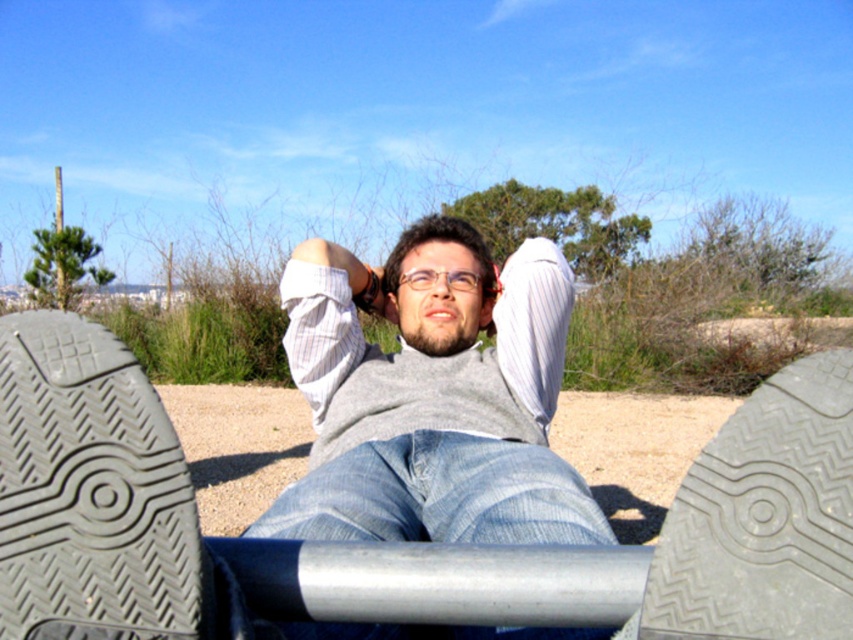
You are a photographer setting up a shoot in this outdoor scene. You need to place a small prop exactly between the gray rubber shoe at lower center and the denim at center. Based on their positions, where should you position the prop?

The gray rubber shoe at lower center is to the right of denim at center, so the prop should be placed midway between them, slightly to the left of the gray rubber shoe at lower center and to the right of the denim at center.

You are a delivery robot that needs to move from the gray rubber shoe at lower center to the lounge chair where the person is resting. The robot has a turning radius of 24 inches. Can it navigate the space between them?

The distance between the gray rubber shoe at lower center and the lounge chair is 26.70 inches. Since the robot has a turning radius of 24 inches, it can navigate the space between them as the distance is greater than the required turning radius.

You are planning to set up a small tent for a quick picnic. You have two options for the location based on the objects in the image. Which location would be more elevated, the light brown sand at center or the green metallic pole at upper left?

The green metallic pole at upper left is more elevated than the light brown sand at center, so setting up the tent near the green metallic pole at upper left would be the more elevated location.